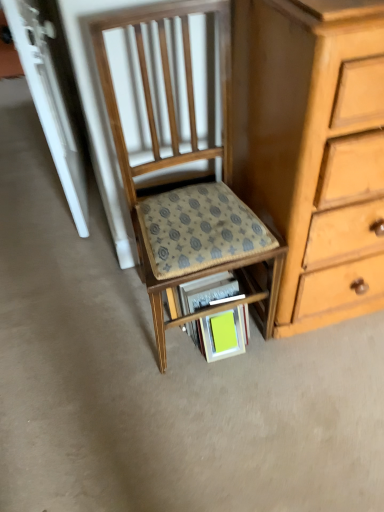
What do you see at coordinates (202, 248) in the screenshot? I see `patterned fabric step stool at center` at bounding box center [202, 248].

Locate an element on the screen. patterned fabric step stool at center is located at coordinates (202, 248).

The width and height of the screenshot is (384, 512). I want to click on bright yellow paper at lower center, so click(x=223, y=332).

You are a GUI agent. You are given a task and a screenshot of the screen. Output one action in this format:
    pyautogui.click(x=<x>, y=<y>)
    Task: Click on the wooden chair at center
    The image size is (384, 512).
    Given the screenshot: What is the action you would take?
    pyautogui.click(x=189, y=186)

Would you say bright yellow paper at lower center is inside or outside patterned fabric step stool at center?

bright yellow paper at lower center lies within the bounds of patterned fabric step stool at center.

At what (x,y) coordinates should I click in order to perform the action: click on step stool that is above the bright yellow paper at lower center (from a real-world perspective). Please return your answer as a coordinate pair (x, y). Looking at the image, I should click on (202, 248).

Would you say bright yellow paper at lower center is to the left or to the right of patterned fabric step stool at center in the picture?

bright yellow paper at lower center is to the right of patterned fabric step stool at center.

Are patterned fabric step stool at center and wooden chair at center located far from each other?

No, patterned fabric step stool at center is in close proximity to wooden chair at center.

Is wooden chair at center completely or partially inside patterned fabric step stool at center?

No, wooden chair at center is located outside of patterned fabric step stool at center.

Is patterned fabric step stool at center wider than wooden chair at center?

No, patterned fabric step stool at center is not wider than wooden chair at center.

What's the angular difference between bright yellow paper at lower center and wooden chair at center's facing directions?

There is a 0.00657-degree angle between the facing directions of bright yellow paper at lower center and wooden chair at center.

Would you say bright yellow paper at lower center is a long distance from wooden chair at center?

No, bright yellow paper at lower center is in close proximity to wooden chair at center.

Considering the positions of objects bright yellow paper at lower center and wooden chair at center in the image provided, who is behind, bright yellow paper at lower center or wooden chair at center?

bright yellow paper at lower center is behind.

Considering the sizes of bright yellow paper at lower center and wooden chair at center in the image, is bright yellow paper at lower center bigger or smaller than wooden chair at center?

Considering their sizes, bright yellow paper at lower center takes up less space than wooden chair at center.

Consider the image. From a real-world perspective, does patterned fabric step stool at center stand above bright yellow paper at lower center?

Yes, from a real-world perspective, patterned fabric step stool at center is above bright yellow paper at lower center.

Could bright yellow paper at lower center be considered to be inside patterned fabric step stool at center?

Yes, bright yellow paper at lower center can be found within patterned fabric step stool at center.

Is bright yellow paper at lower center at the back of patterned fabric step stool at center?

No, patterned fabric step stool at center is not facing the opposite direction of bright yellow paper at lower center.

Does patterned fabric step stool at center have a greater width compared to bright yellow paper at lower center?

Correct, the width of patterned fabric step stool at center exceeds that of bright yellow paper at lower center.

Based on the photo, can you confirm if wooden chair at center is shorter than bright yellow paper at lower center?

In fact, wooden chair at center may be taller than bright yellow paper at lower center.

Between wooden chair at center and bright yellow paper at lower center, which one appears on the right side from the viewer's perspective?

From the viewer's perspective, bright yellow paper at lower center appears more on the right side.

Is wooden chair at center completely or partially outside of bright yellow paper at lower center?

wooden chair at center lies outside bright yellow paper at lower center's area.

From the image's perspective, is wooden chair at center above or below bright yellow paper at lower center?

Clearly, from the image's perspective, wooden chair at center is above bright yellow paper at lower center.

Is wooden chair at center directly adjacent to patterned fabric step stool at center?

Yes, wooden chair at center is in contact with patterned fabric step stool at center.

From the image's perspective, does wooden chair at center appear higher than patterned fabric step stool at center?

Yes, from the image's perspective, wooden chair at center is above patterned fabric step stool at center.

Which is nearer, (192, 11) or (239, 248)?

The point (192, 11) is closer.

Can you confirm if wooden chair at center is positioned to the left of patterned fabric step stool at center?

Indeed, wooden chair at center is positioned on the left side of patterned fabric step stool at center.

Where is `step stool in front of the bright yellow paper at lower center`? The width and height of the screenshot is (384, 512). step stool in front of the bright yellow paper at lower center is located at coordinates (202, 248).

Identify the location of step stool on the right of wooden chair at center. (202, 248).

Estimate the real-world distances between objects in this image. Which object is further from wooden chair at center, patterned fabric step stool at center or bright yellow paper at lower center?

Based on the image, bright yellow paper at lower center appears to be further to wooden chair at center.

In the scene shown: Considering their positions, is bright yellow paper at lower center positioned further to patterned fabric step stool at center than wooden chair at center?

bright yellow paper at lower center lies further to patterned fabric step stool at center than the other object.

Which object lies further to the anchor point wooden chair at center, bright yellow paper at lower center or patterned fabric step stool at center?

bright yellow paper at lower center is further to wooden chair at center.

Estimate the real-world distances between objects in this image. Which object is further from bright yellow paper at lower center, patterned fabric step stool at center or wooden chair at center?

The object further to bright yellow paper at lower center is wooden chair at center.

Based on their spatial positions, is wooden chair at center or bright yellow paper at lower center further from patterned fabric step stool at center?

bright yellow paper at lower center lies further to patterned fabric step stool at center than the other object.

Based on their spatial positions, is wooden chair at center or patterned fabric step stool at center closer to bright yellow paper at lower center?

patterned fabric step stool at center is positioned closer to the anchor bright yellow paper at lower center.

You are a GUI agent. You are given a task and a screenshot of the screen. Output one action in this format:
    pyautogui.click(x=<x>, y=<y>)
    Task: Click on the step stool between wooden chair at center and bright yellow paper at lower center along the z-axis
    The height and width of the screenshot is (512, 384).
    Given the screenshot: What is the action you would take?
    coord(202,248)